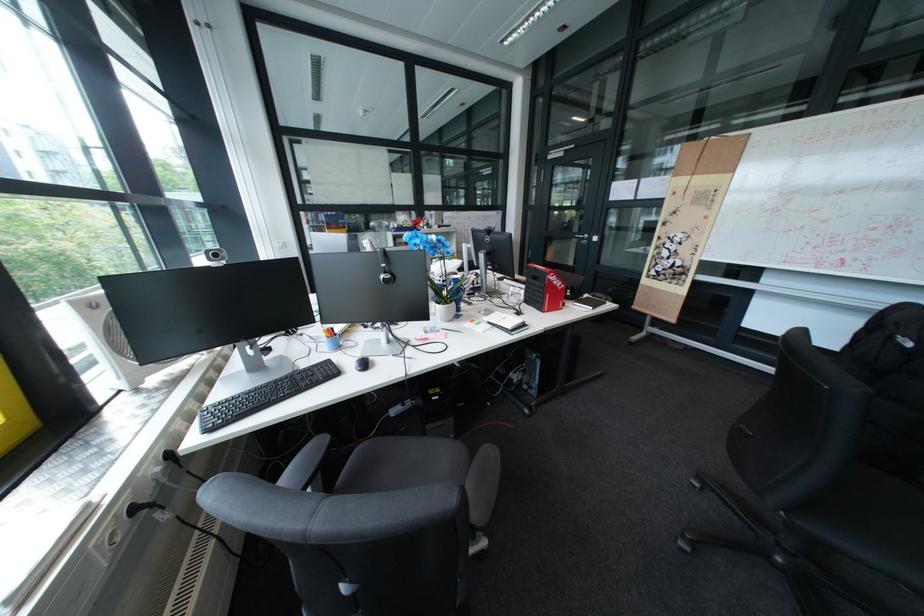
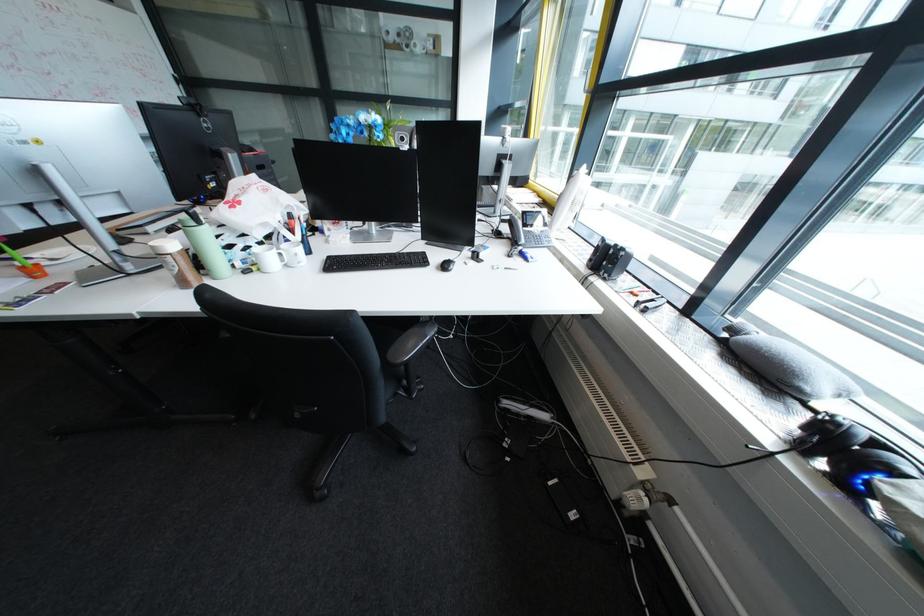
Question: I am providing you with two images of the same scene from different viewpoints. Please identify which objects are invisible in image2.

Choices:
 (A) chair sitting surface
 (B) small chrome fan
 (C) small black notebook
 (D) brown shaker bottle

Answer: (C)